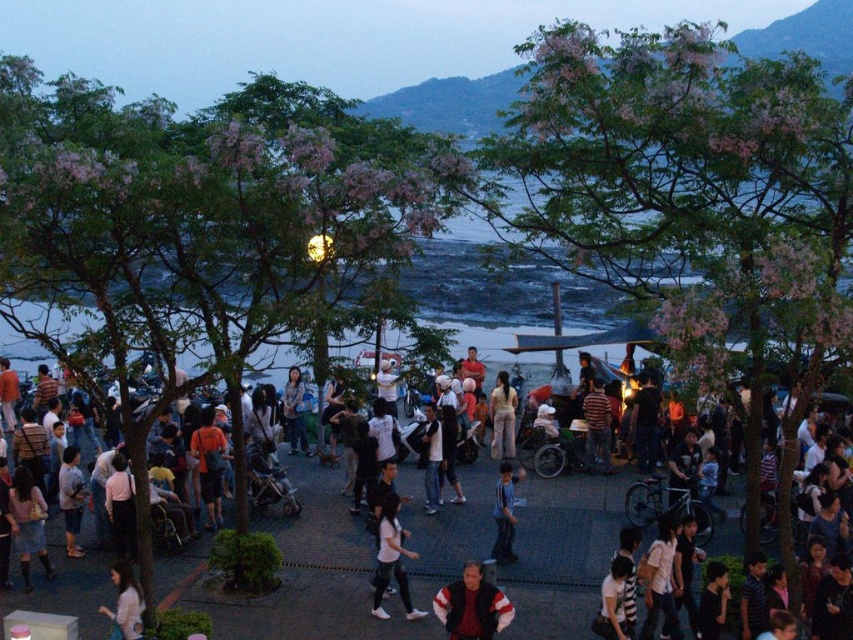
Based on the photo, can you confirm if green leafy tree at center is shorter than white matte shirt at center?

In fact, green leafy tree at center may be taller than white matte shirt at center.

Does point (79, 305) lie behind point (392, 529)?

No, it is in front of (392, 529).

What do you see at coordinates (201, 228) in the screenshot? Image resolution: width=853 pixels, height=640 pixels. I see `green leafy tree at center` at bounding box center [201, 228].

This screenshot has height=640, width=853. What are the coordinates of `green leafy tree at center` in the screenshot? It's located at (201, 228).

Is pink blossoming tree at center wider than blue denim jeans at center?

Indeed, pink blossoming tree at center has a greater width compared to blue denim jeans at center.

Can you confirm if pink blossoming tree at center is bigger than blue denim jeans at center?

Yes, pink blossoming tree at center is bigger than blue denim jeans at center.

Measure the distance between pink blossoming tree at center and camera.

pink blossoming tree at center and camera are 39.35 meters apart from each other.

Find the location of a particular element. The image size is (853, 640). pink blossoming tree at center is located at coordinates (688, 202).

Is white cotton shirt at center taller than white matte shirt at center?

Indeed, white cotton shirt at center has a greater height compared to white matte shirt at center.

Does point (318, 477) lie behind point (381, 544)?

That is True.

Who is more distant from viewer, (x=421, y=564) or (x=375, y=593)?

The point (x=421, y=564) is behind.

Where is `white cotton shirt at center`? This screenshot has height=640, width=853. white cotton shirt at center is located at coordinates (x=316, y=576).